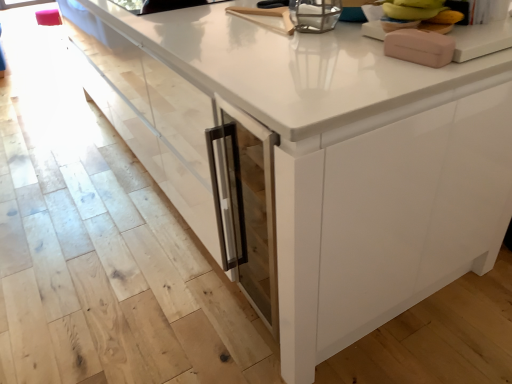
Locate an element on the screen. Image resolution: width=512 pixels, height=384 pixels. empty space that is to the right of yellow banana at upper right is located at coordinates (476, 26).